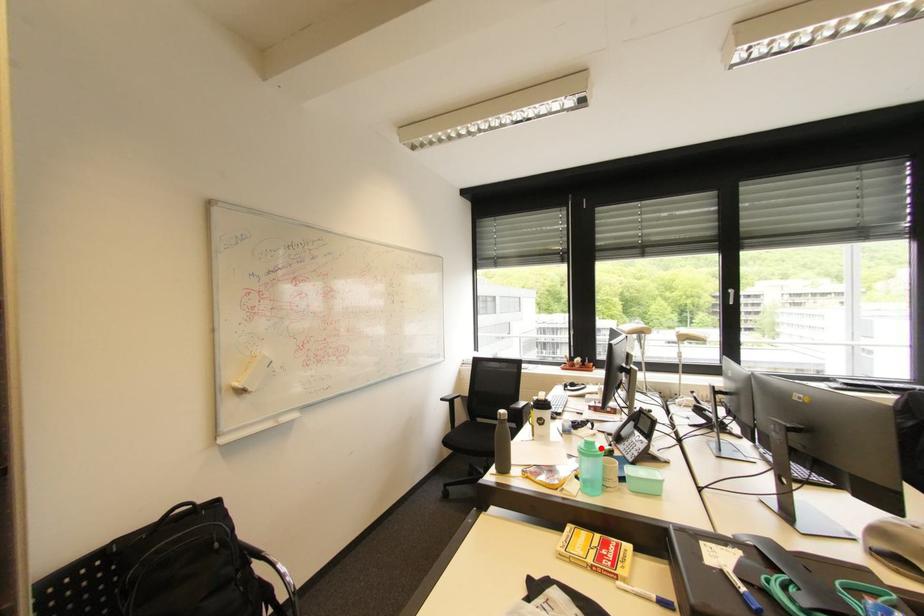
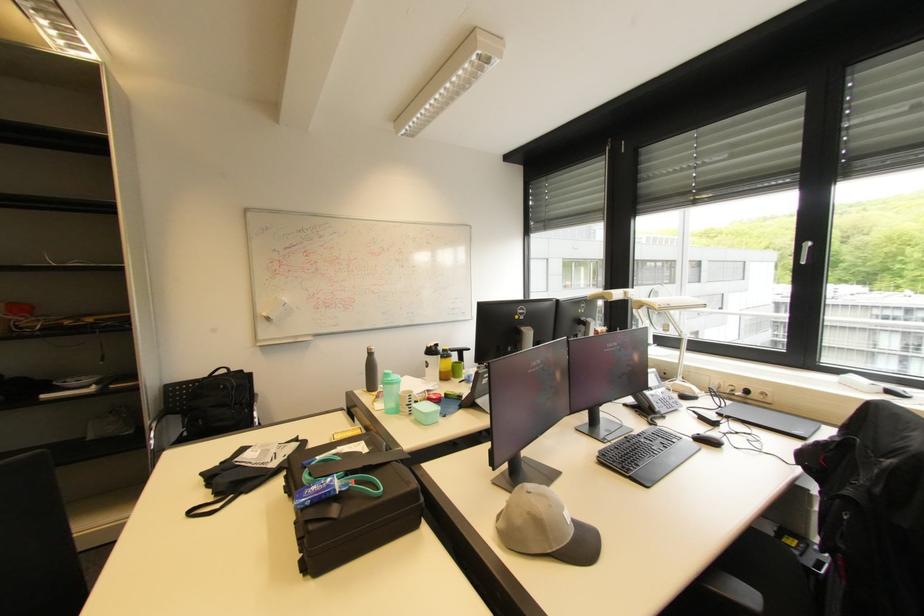
Question: A red point is marked in image1. In image2, is the corresponding 3D point closer to the camera or farther? Reply with the corresponding letter.

Choices:
 (A) The corresponding 3D point is closer.
 (B) The corresponding 3D point is farther.

Answer: (B)